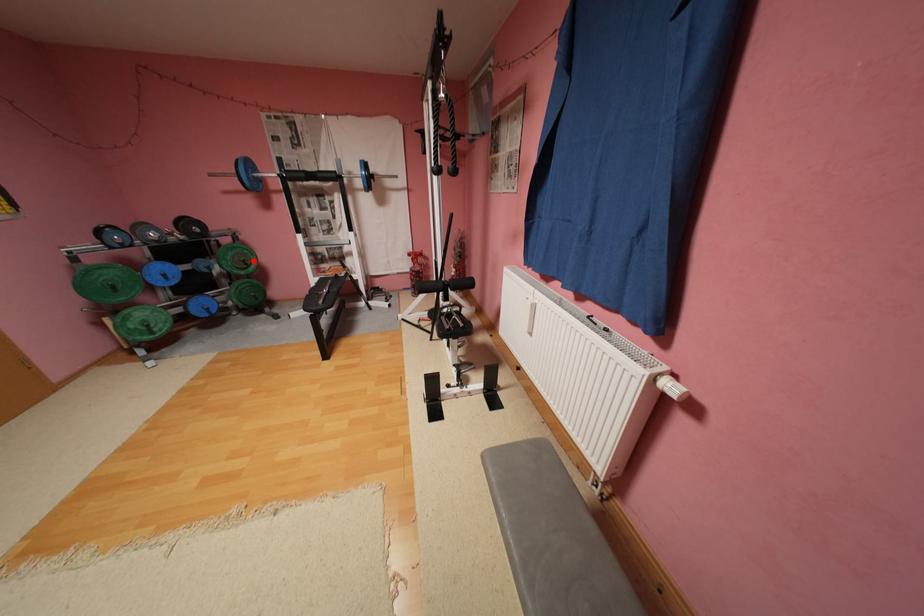
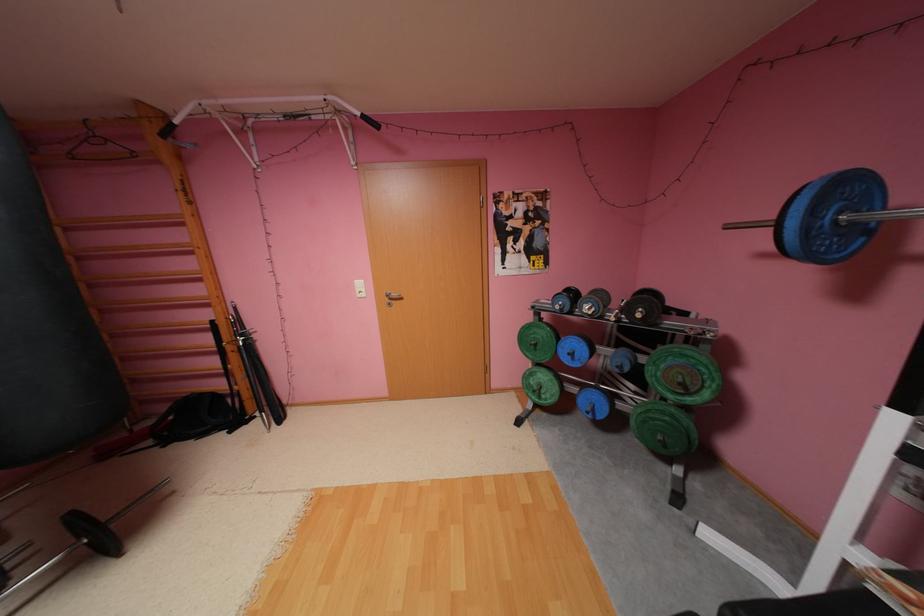
Find the pixel in the second image that matches the highlighted location in the first image.

(690, 384)